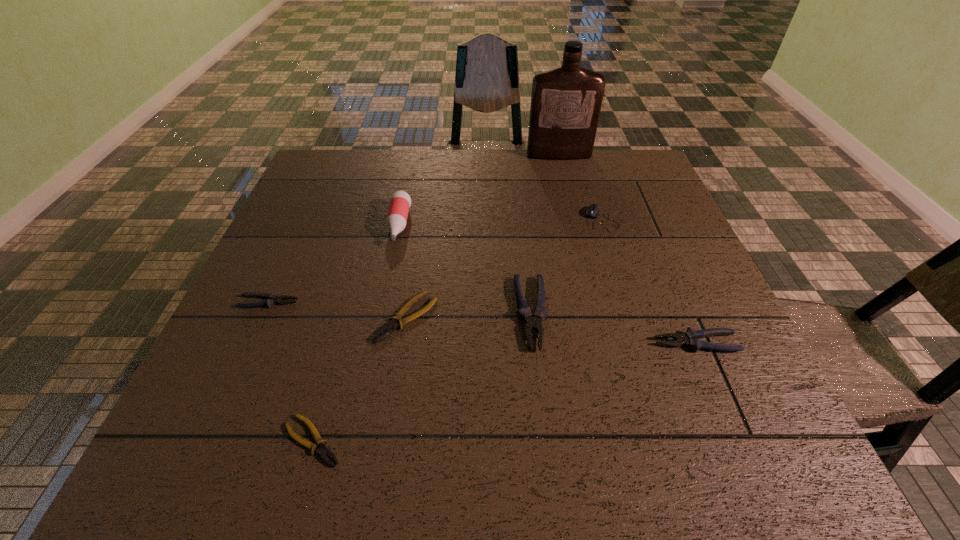
You are a GUI agent. You are given a task and a screenshot of the screen. Output one action in this format:
    pyautogui.click(x=<x>, y=<y>)
    Task: Click on the vacant area that satisfies the following two spatial constraints: 1. with the cap open on the second tallest object; 2. at the gripping part of the third shortest pliers
    
    Given the screenshot: What is the action you would take?
    pyautogui.click(x=383, y=302)